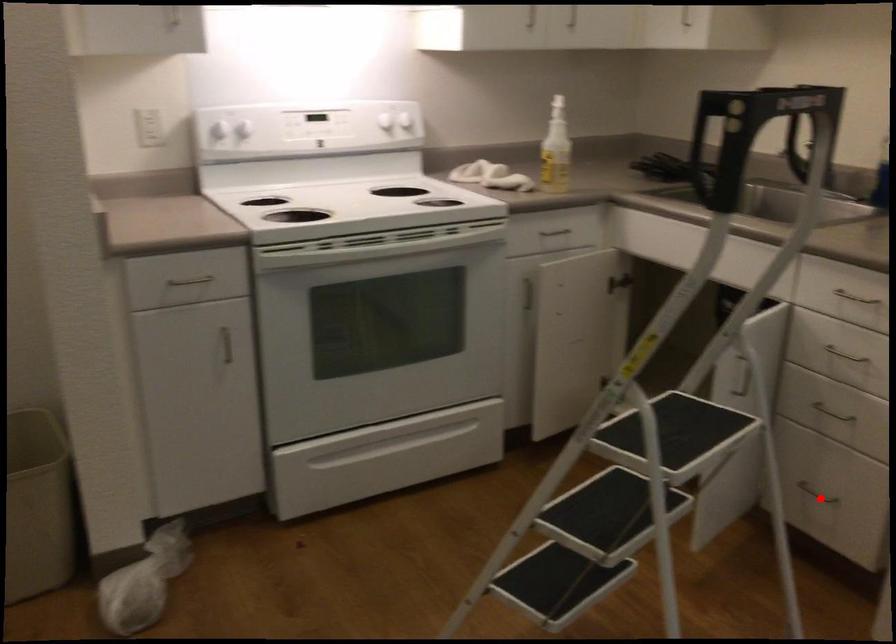
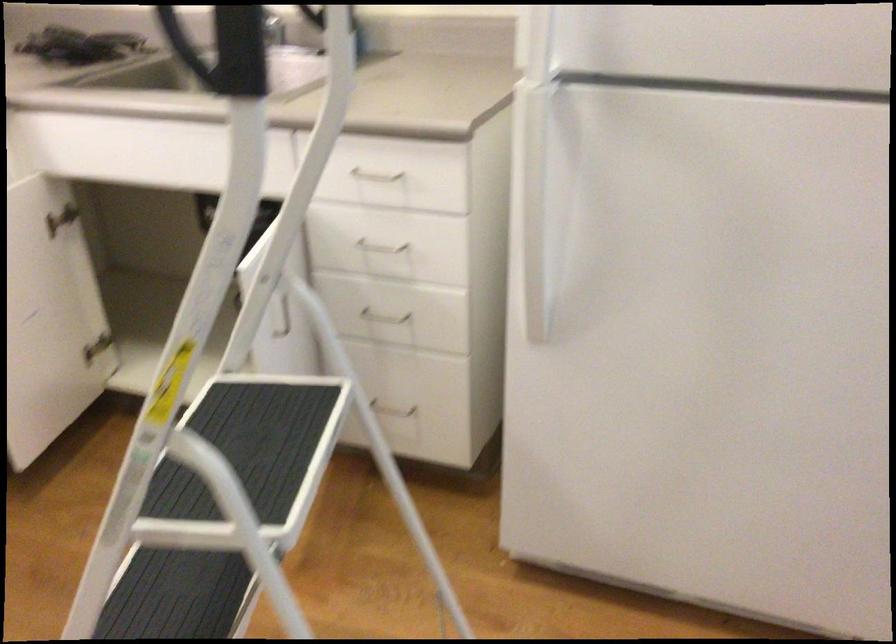
Question: A red point is marked in image1. In image2, is the corresponding 3D point closer to the camera or farther? Reply with the corresponding letter.

Choices:
 (A) The corresponding 3D point is closer.
 (B) The corresponding 3D point is farther.

Answer: (A)